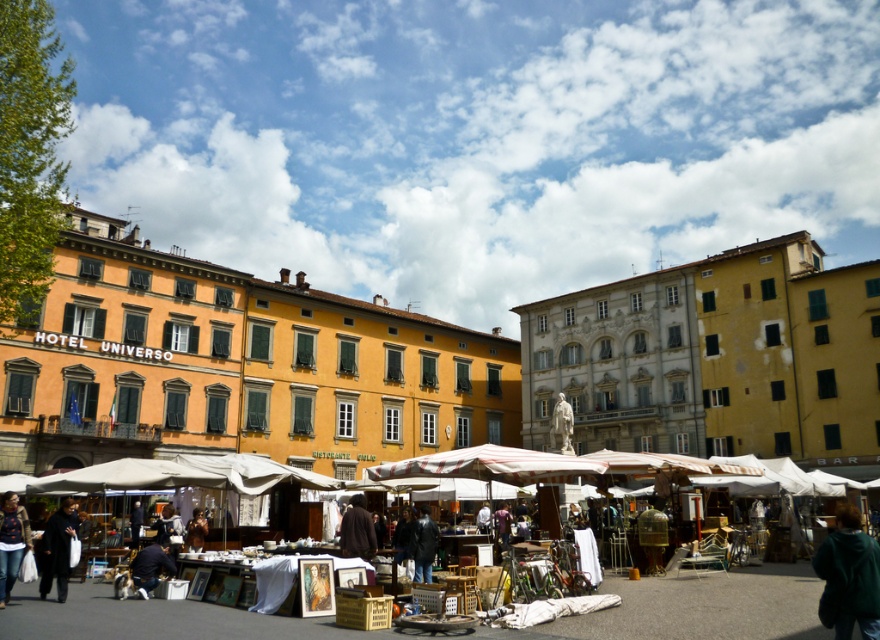
Between wooden crates at center and green fuzzy jacket at lower right, which one appears on the left side from the viewer's perspective?

From the viewer's perspective, wooden crates at center appears more on the left side.

Which is above, wooden crates at center or green fuzzy jacket at lower right?

green fuzzy jacket at lower right is higher up.

The image size is (880, 640). In order to click on wooden crates at center in this screenshot , I will do `click(699, 608)`.

What do you see at coordinates (848, 577) in the screenshot?
I see `green fuzzy jacket at lower right` at bounding box center [848, 577].

Can you confirm if green fuzzy jacket at lower right is positioned to the left of dark blue leather jacket at center?

No, green fuzzy jacket at lower right is not to the left of dark blue leather jacket at center.

In order to click on green fuzzy jacket at lower right in this screenshot , I will do `click(848, 577)`.

Is green fuzzy jacket at lower right positioned behind brown woolen sweater at center?

No.

Is green fuzzy jacket at lower right shorter than brown woolen sweater at center?

Incorrect, green fuzzy jacket at lower right's height does not fall short of brown woolen sweater at center's.

Does point (827, 561) come closer to viewer compared to point (339, 541)?

Yes, point (827, 561) is closer to viewer.

I want to click on green fuzzy jacket at lower right, so click(848, 577).